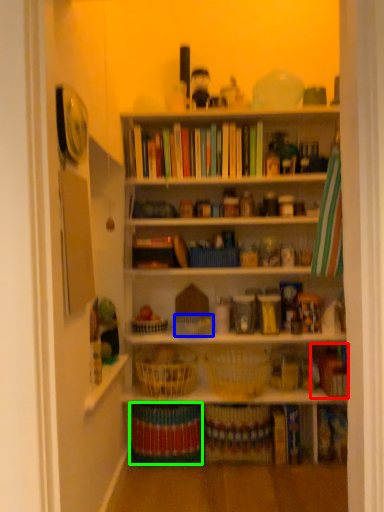
Question: Considering the real-world distances, which object is farthest from book (highlighted by a red box)? basket (highlighted by a blue box) or book (highlighted by a green box)?

Choices:
 (A) basket
 (B) book

Answer: (B)